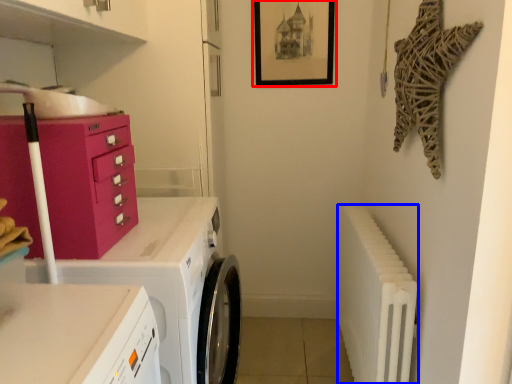
Question: Which point is closer to the camera, picture frame (highlighted by a red box) or radiator (highlighted by a blue box)?

Choices:
 (A) picture frame
 (B) radiator

Answer: (B)